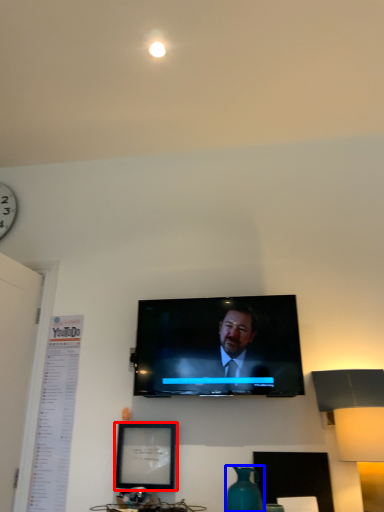
Question: Which of the following is the closest to the observer, picture frame (highlighted by a red box) or vase (highlighted by a blue box)?

Choices:
 (A) picture frame
 (B) vase

Answer: (B)